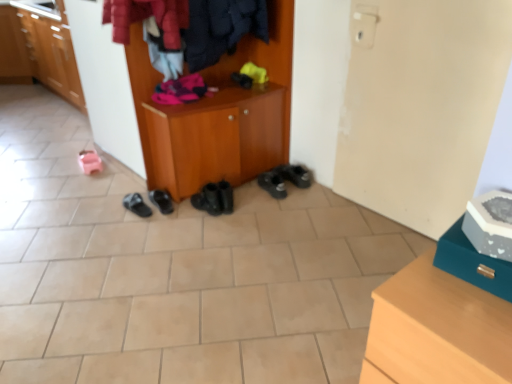
The width and height of the screenshot is (512, 384). In order to click on vacant area that lies between pink rubber sandals at lower left, which is the first footwear in left-to-right order, and black rubber sandals at center, which appears as the second footwear when viewed from the left in this screenshot , I will do `click(113, 186)`.